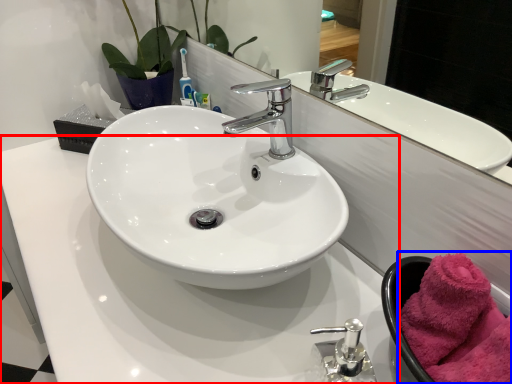
Question: Which of the following is the closest to the observer, counter top (highlighted by a red box) or bath towel (highlighted by a blue box)?

Choices:
 (A) counter top
 (B) bath towel

Answer: (A)